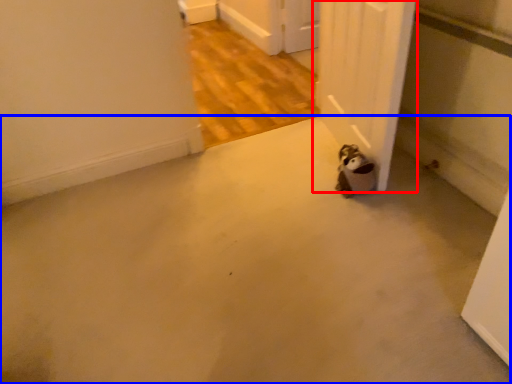
Question: Which object appears farthest to the camera in this image, door (highlighted by a red box) or concrete (highlighted by a blue box)?

Choices:
 (A) door
 (B) concrete

Answer: (A)